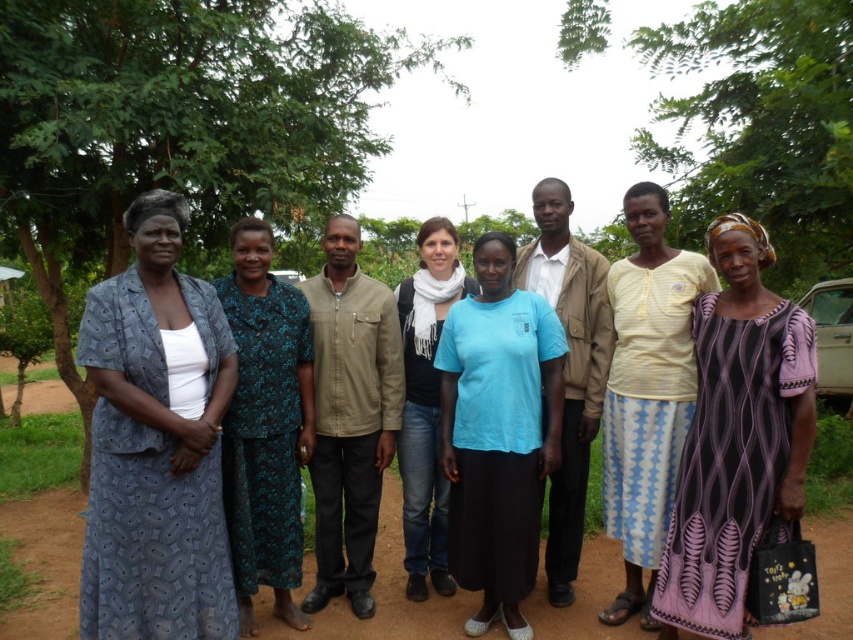
Question: Which object is the closest to the printed fabric dress at left?

Choices:
 (A) blue cotton shirt at center
 (B) teal floral dress at center
 (C) green leafy tree at center

Answer: (A)

Question: Is light brown leather jacket at center positioned at the back of blue cotton shirt at center?

Choices:
 (A) no
 (B) yes

Answer: (A)

Question: Which of the following is the farthest from the observer?

Choices:
 (A) (788, 497)
 (B) (136, 397)
 (C) (395, 554)

Answer: (C)

Question: Does green leafy tree at center have a greater width compared to light brown leather jacket at center?

Choices:
 (A) yes
 (B) no

Answer: (A)

Question: Does green leafy tree at center lie behind yellow striped shirt at center?

Choices:
 (A) yes
 (B) no

Answer: (A)

Question: Which point is closer to the camera?

Choices:
 (A) blue cotton shirt at center
 (B) printed fabric dress at left
 (C) green leafy tree at center
 (D) brown dirt track at lower center

Answer: (B)